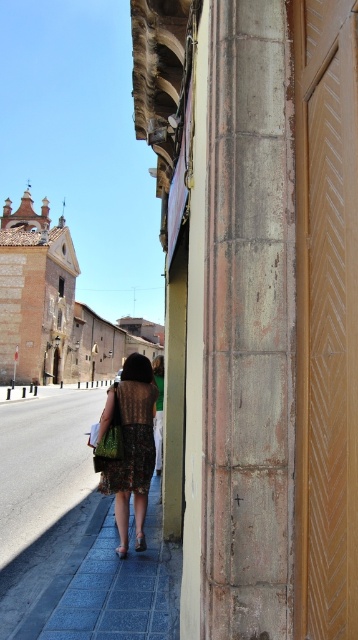
Is point (229, 144) behind point (123, 481)?

No, (229, 144) is closer to viewer.

You are a GUI agent. You are given a task and a screenshot of the screen. Output one action in this format:
    pyautogui.click(x=<x>, y=<y>)
    Task: Click on the gray stone column at center
    
    Given the screenshot: What is the action you would take?
    pyautogui.click(x=248, y=326)